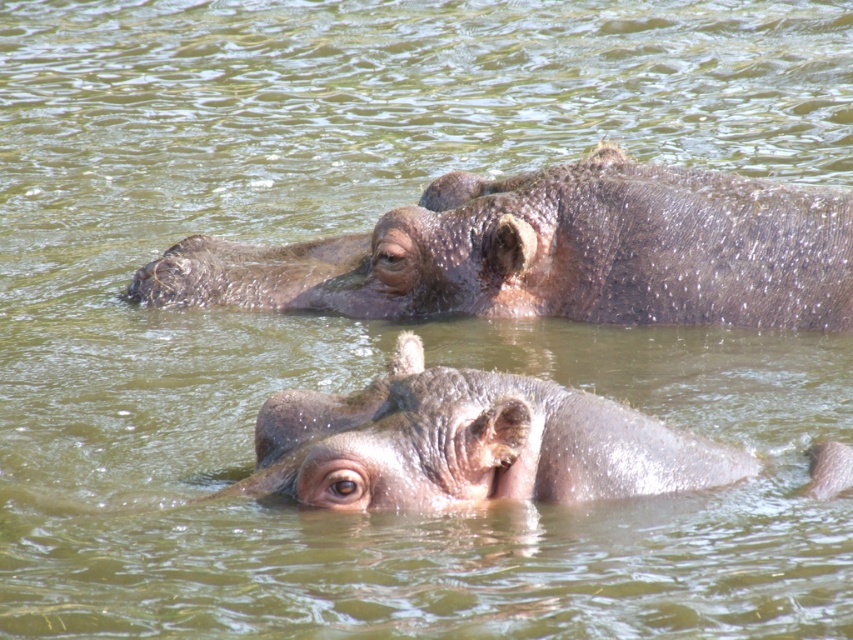
Which of these two, wet brown hippo at upper center or gray matte elephant at center, stands taller?

wet brown hippo at upper center is taller.

Who is more distant from viewer, [277,272] or [595,458]?

The point [277,272] is behind.

Is point (552, 198) in front of point (560, 477)?

No, it is behind (560, 477).

Locate an element on the screen. wet brown hippo at upper center is located at coordinates (553, 252).